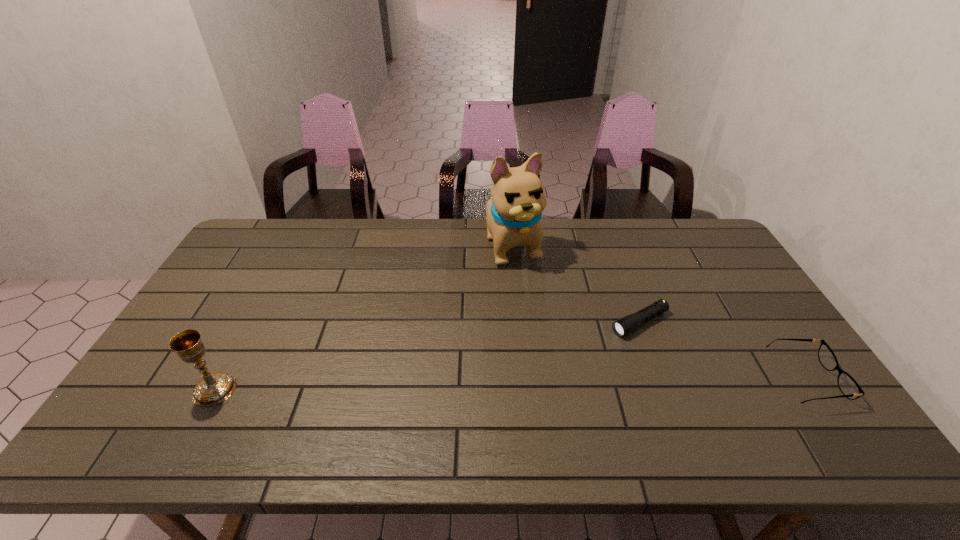
Find the location of a particular element. Image resolution: width=960 pixels, height=540 pixels. free spot between the farthest object and the flashlight is located at coordinates (576, 284).

Locate an element on the screen. free space between the puppy and the second object from right to left is located at coordinates (576, 284).

Identify the location of vacant space that is in between the rightmost object and the shortest object. This screenshot has width=960, height=540. (723, 350).

You are a GUI agent. You are given a task and a screenshot of the screen. Output one action in this format:
    pyautogui.click(x=<x>, y=<y>)
    Task: Click on the empty space that is in between the shortest object and the leftmost object
    The height and width of the screenshot is (540, 960).
    Given the screenshot: What is the action you would take?
    pyautogui.click(x=427, y=356)

Where is `free space between the third shortest object and the second shortest object`? Image resolution: width=960 pixels, height=540 pixels. free space between the third shortest object and the second shortest object is located at coordinates (511, 384).

Where is `vacant area that lies between the spectacles and the third shortest object`? The image size is (960, 540). vacant area that lies between the spectacles and the third shortest object is located at coordinates [x=511, y=384].

Select which object appears as the second closest to the chalice. Please provide its 2D coordinates. Your answer should be formatted as a tuple, i.e. [(x, y)], where the tuple contains the x and y coordinates of a point satisfying the conditions above.

[(625, 325)]

Locate an element on the screen. The width and height of the screenshot is (960, 540). object that is the third closest one to the leftmost object is located at coordinates (849, 387).

At what (x,y) coordinates should I click in order to perform the action: click on vacant space that satisfies the following two spatial constraints: 1. on the back side of the chalice; 2. on the front-facing side of the spectacles. Please return your answer as a coordinate pair (x, y). Image resolution: width=960 pixels, height=540 pixels. Looking at the image, I should click on (221, 379).

Locate an element on the screen. This screenshot has height=540, width=960. blank space that satisfies the following two spatial constraints: 1. on the front side of the farthest object; 2. on the front-facing side of the spectacles is located at coordinates (525, 379).